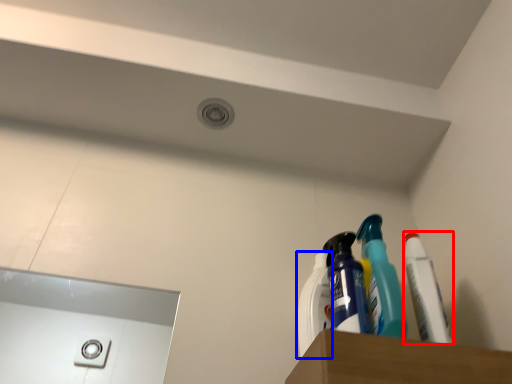
Question: Which point is further to the camera, toothpaste (highlighted by a red box) or cleaning product (highlighted by a blue box)?

Choices:
 (A) toothpaste
 (B) cleaning product

Answer: (B)